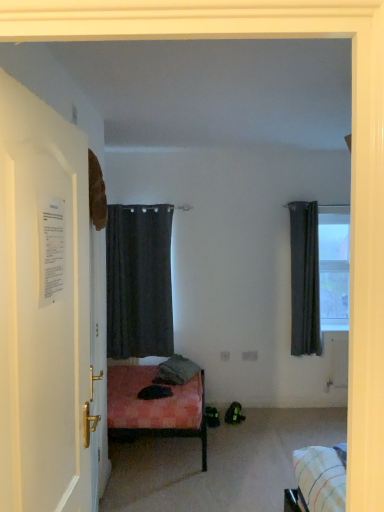
Question: Which direction should I rotate to look at dark matte curtain at center, arranged as the 2th curtain when viewed from the right?

Choices:
 (A) right
 (B) left

Answer: (B)

Question: Is gray fabric pillow at center looking in the opposite direction of transparent glass window at upper right?

Choices:
 (A) yes
 (B) no

Answer: (B)

Question: Can you confirm if gray fabric pillow at center is bigger than transparent glass window at upper right?

Choices:
 (A) no
 (B) yes

Answer: (B)

Question: From the image's perspective, is gray fabric pillow at center over transparent glass window at upper right?

Choices:
 (A) no
 (B) yes

Answer: (A)

Question: Is gray fabric pillow at center to the left of transparent glass window at upper right from the viewer's perspective?

Choices:
 (A) yes
 (B) no

Answer: (A)

Question: Can you confirm if gray fabric pillow at center is wider than transparent glass window at upper right?

Choices:
 (A) no
 (B) yes

Answer: (B)

Question: Is gray fabric pillow at center touching transparent glass window at upper right?

Choices:
 (A) no
 (B) yes

Answer: (A)

Question: Is dark gray fabric curtain at right, the 2th curtain when ordered from left to right, looking in the opposite direction of transparent glass window at upper right?

Choices:
 (A) no
 (B) yes

Answer: (A)

Question: Is dark gray fabric curtain at right, which is the first curtain from right to left, placed right next to transparent glass window at upper right?

Choices:
 (A) no
 (B) yes

Answer: (A)

Question: Is the position of dark gray fabric curtain at right, the 2th curtain when ordered from left to right, less distant than that of transparent glass window at upper right?

Choices:
 (A) yes
 (B) no

Answer: (A)

Question: From the image's perspective, would you say dark gray fabric curtain at right, the 2th curtain when ordered from left to right, is shown under transparent glass window at upper right?

Choices:
 (A) no
 (B) yes

Answer: (B)

Question: Is dark gray fabric curtain at right, which is the first curtain from right to left, to the left of transparent glass window at upper right from the viewer's perspective?

Choices:
 (A) no
 (B) yes

Answer: (B)

Question: Is dark gray fabric curtain at right, the 2th curtain when ordered from left to right, further to camera compared to transparent glass window at upper right?

Choices:
 (A) yes
 (B) no

Answer: (B)

Question: From the image's perspective, would you say dark matte curtain at center, which is the first curtain in left-to-right order, is positioned over dark gray fabric curtain at right, the 2th curtain when ordered from left to right?

Choices:
 (A) no
 (B) yes

Answer: (A)